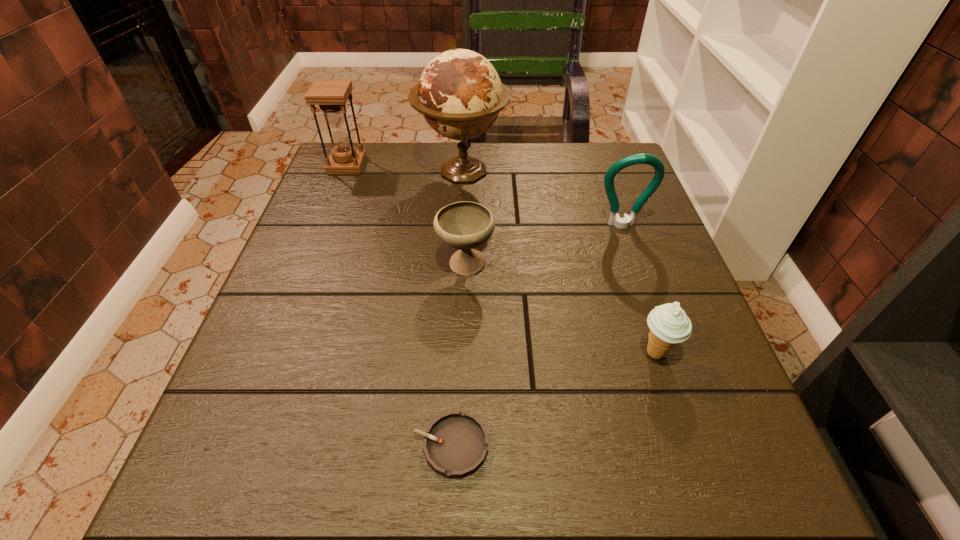
The image size is (960, 540). Identify the location of free space located 0.210m on the right of the third nearest object. (591, 265).

Identify the location of free space located 0.280m on the left of the fifth farthest object. The height and width of the screenshot is (540, 960). (480, 353).

I want to click on vacant point located 0.130m on the back of the shortest object, so 456,349.

Where is `globe positioned at the far edge`? The height and width of the screenshot is (540, 960). globe positioned at the far edge is located at coordinates (460, 95).

Where is `hourglass that is at the far edge`? This screenshot has height=540, width=960. hourglass that is at the far edge is located at coordinates (331, 95).

You are a GUI agent. You are given a task and a screenshot of the screen. Output one action in this format:
    pyautogui.click(x=<x>, y=<y>)
    Task: Click on the object positioned at the near edge
    The width and height of the screenshot is (960, 540).
    Given the screenshot: What is the action you would take?
    pyautogui.click(x=455, y=444)

You are a GUI agent. You are given a task and a screenshot of the screen. Output one action in this format:
    pyautogui.click(x=<x>, y=<y>)
    Task: Click on the object present at the left edge
    Image resolution: width=960 pixels, height=540 pixels.
    Given the screenshot: What is the action you would take?
    pyautogui.click(x=331, y=95)

You are a GUI agent. You are given a task and a screenshot of the screen. Output one action in this format:
    pyautogui.click(x=<x>, y=<y>)
    Task: Click on the bottle opener present at the right edge
    The image size is (960, 540).
    Given the screenshot: What is the action you would take?
    pyautogui.click(x=614, y=219)

Find the location of a particular element. icecream that is at the right edge is located at coordinates (669, 325).

Where is `object at the far left corner`? The image size is (960, 540). object at the far left corner is located at coordinates (331, 95).